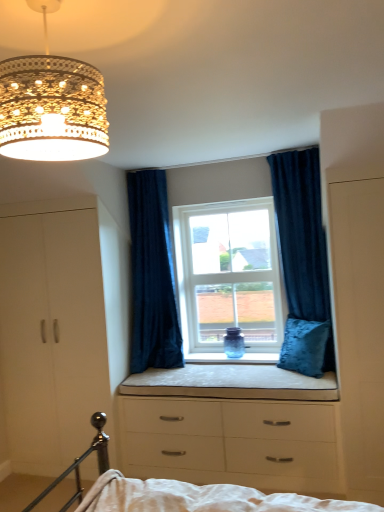
You are a GUI agent. You are given a task and a screenshot of the screen. Output one action in this format:
    pyautogui.click(x=<x>, y=<y>)
    Task: Click on the empty space that is ontop of velvet dark blue curtain at center, acting as the first curtain starting from the left (from a real-world perspective)
    This screenshot has width=384, height=512.
    Given the screenshot: What is the action you would take?
    pyautogui.click(x=157, y=161)